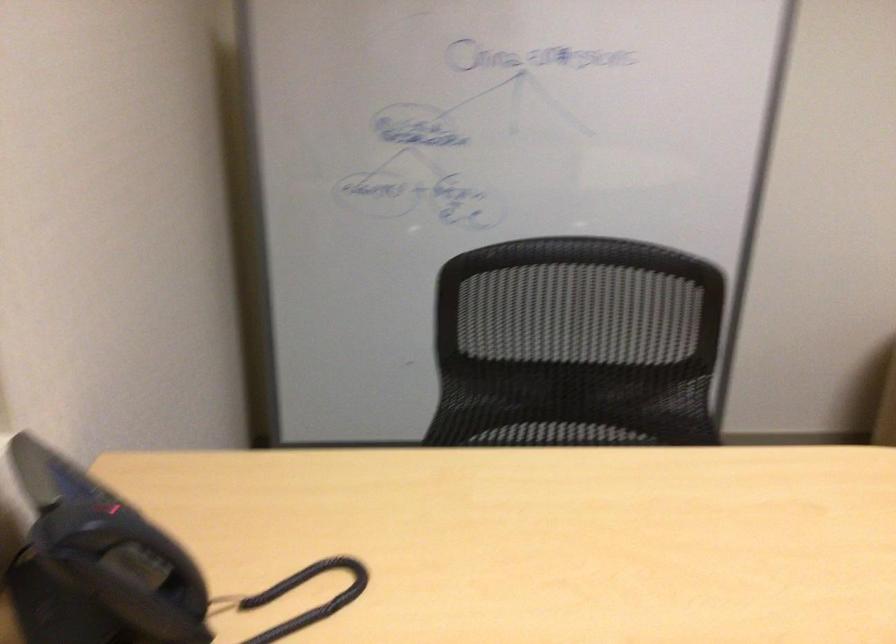
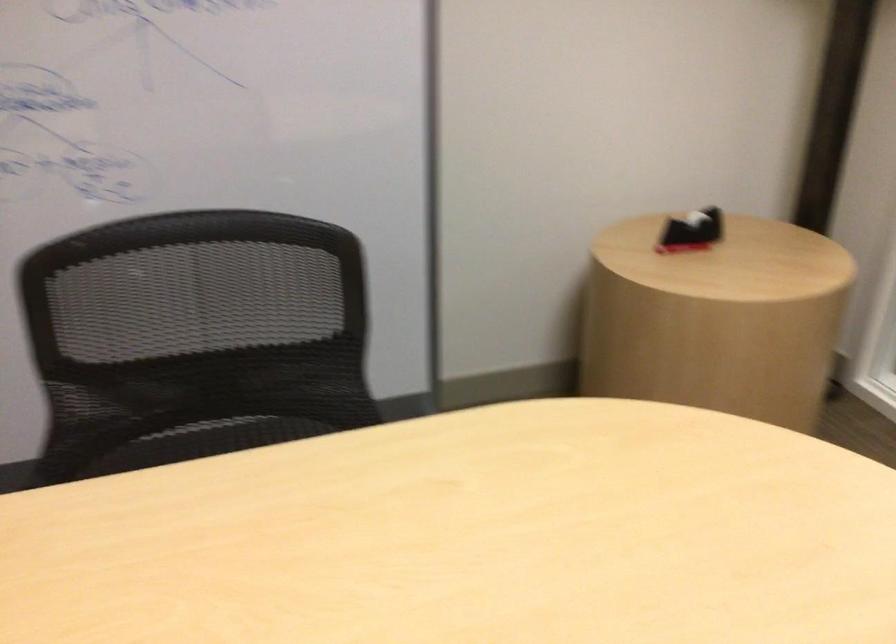
The point at (569, 436) is marked in the first image. Where is the corresponding point in the second image?

(218, 438)